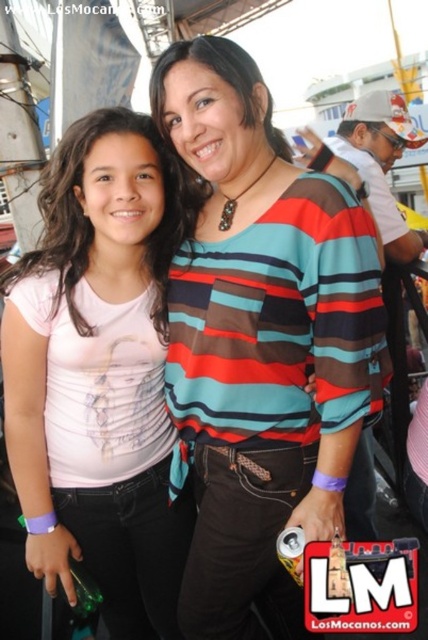
You are at a public event and want to take a photo of both the young girl and the adult woman. You notice two points marked in the image at coordinates point (178, 424) and point (65, 531). Which point should you stand behind to ensure both subjects are fully visible in your photo?

You should stand behind point (65, 531) because point (178, 424) is behind it, so standing there might block the view of the adult woman.

Consider the image. You are taking a photo of two people wearing the striped cotton shirt at center and the pink matte shirt at center. Which shirt is positioned more to the right in the photo?

The striped cotton shirt at center is to the right of the pink matte shirt at center, so the striped cotton shirt at center is positioned more to the right in the photo.